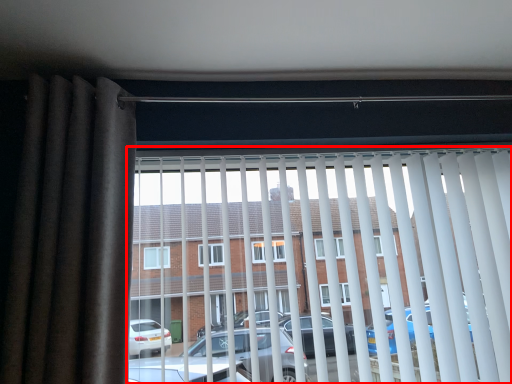
Question: From the image's perspective, what is the correct spatial relationship of window blind (annotated by the red box) in relation to curtain?

Choices:
 (A) below
 (B) above

Answer: (A)